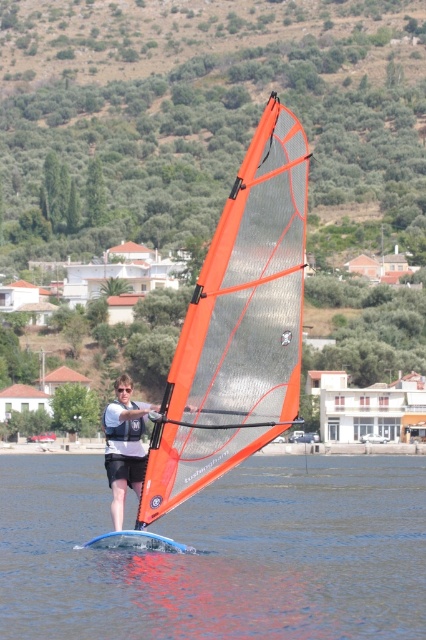
Question: Which object appears farthest from the camera in this image?

Choices:
 (A) orange mesh sail at center
 (B) transparent blue windsurf board at center

Answer: (A)

Question: Considering the real-world distances, which object is farthest from the transparent blue windsurf board at center?

Choices:
 (A) matte white windsurfing board at center
 (B) orange mesh sail at center

Answer: (A)

Question: Does orange mesh sail at center come behind matte white windsurfing board at center?

Choices:
 (A) no
 (B) yes

Answer: (A)

Question: Is transparent blue windsurf board at center above orange mesh sail at center?

Choices:
 (A) no
 (B) yes

Answer: (A)

Question: Is transparent blue windsurf board at center further to the viewer compared to orange mesh sail at center?

Choices:
 (A) no
 (B) yes

Answer: (A)

Question: Based on their relative distances, which object is nearer to the orange mesh sail at center?

Choices:
 (A) matte white windsurfing board at center
 (B) transparent blue windsurf board at center

Answer: (A)